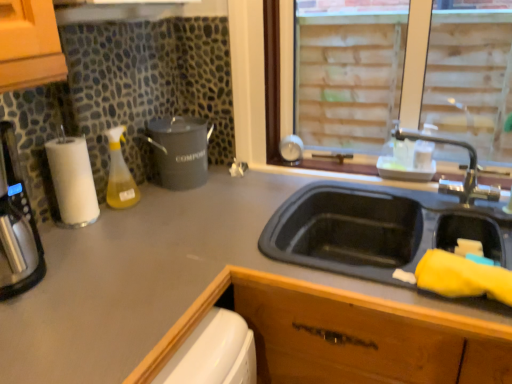
Question: Does brass metallic faucet at upper right have a lesser width compared to matte gray countertop at center?

Choices:
 (A) yes
 (B) no

Answer: (A)

Question: From a real-world perspective, is brass metallic faucet at upper right physically above matte gray countertop at center?

Choices:
 (A) yes
 (B) no

Answer: (A)

Question: Considering the relative positions of brass metallic faucet at upper right and matte gray countertop at center in the image provided, is brass metallic faucet at upper right to the left of matte gray countertop at center from the viewer's perspective?

Choices:
 (A) no
 (B) yes

Answer: (A)

Question: Can you confirm if brass metallic faucet at upper right is taller than matte gray countertop at center?

Choices:
 (A) yes
 (B) no

Answer: (B)

Question: Are brass metallic faucet at upper right and matte gray countertop at center far apart?

Choices:
 (A) no
 (B) yes

Answer: (A)

Question: Is white paper towel at left inside or outside of matte black compost bin at center-left?

Choices:
 (A) inside
 (B) outside

Answer: (B)

Question: Looking at their shapes, would you say white paper towel at left is wider or thinner than matte black compost bin at center-left?

Choices:
 (A) wide
 (B) thin

Answer: (B)

Question: From a real-world perspective, relative to matte black compost bin at center-left, is white paper towel at left vertically above or below?

Choices:
 (A) below
 (B) above

Answer: (B)

Question: Is white paper towel at left taller or shorter than matte black compost bin at center-left?

Choices:
 (A) short
 (B) tall

Answer: (B)

Question: From a real-world perspective, relative to white paper towel at left, is translucent yellow liquid at bottle left vertically above or below?

Choices:
 (A) above
 (B) below

Answer: (B)

Question: Is point (106, 201) positioned closer to the camera than point (82, 165)?

Choices:
 (A) farther
 (B) closer

Answer: (A)

Question: Is translucent yellow liquid at bottle left to the left or to the right of white paper towel at left in the image?

Choices:
 (A) left
 (B) right

Answer: (B)

Question: Looking at their shapes, would you say translucent yellow liquid at bottle left is wider or thinner than white paper towel at left?

Choices:
 (A) thin
 (B) wide

Answer: (A)

Question: In the image, is white paper towel at left positioned in front of or behind translucent yellow liquid at bottle left?

Choices:
 (A) behind
 (B) front

Answer: (B)

Question: Do you think white paper towel at left is within translucent yellow liquid at bottle left, or outside of it?

Choices:
 (A) inside
 (B) outside

Answer: (B)